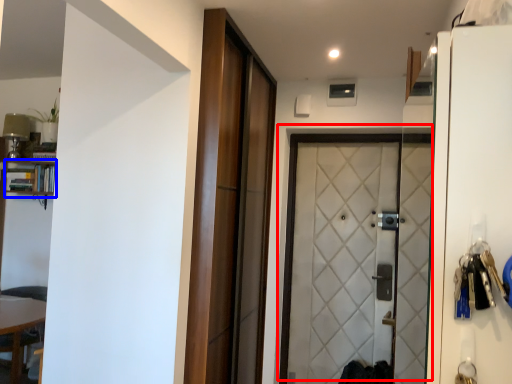
Question: Which point is further to the camera, door (highlighted by a red box) or bookshelf (highlighted by a blue box)?

Choices:
 (A) door
 (B) bookshelf

Answer: (B)